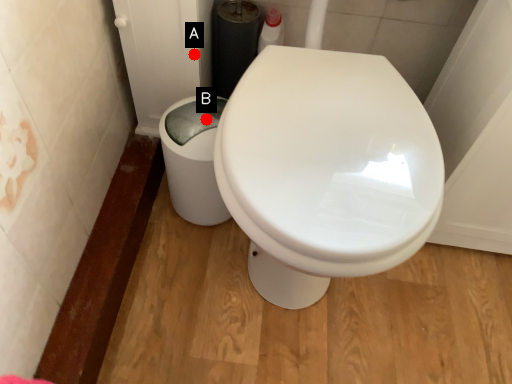
Question: Two points are circled on the image, labeled by A and B beside each circle. Which of the following is the farthest from the observer?

Choices:
 (A) A is further
 (B) B is further

Answer: (B)